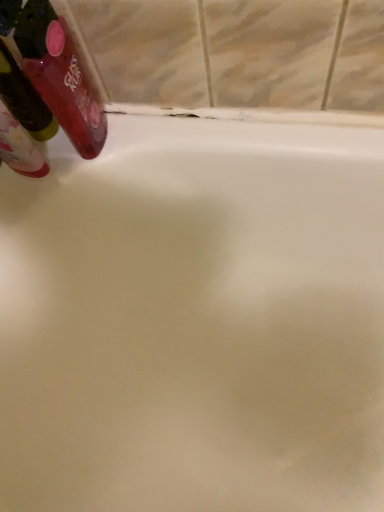
Find the location of `vacant area situated to the left side of translucent plastic mouthwash at upper left, arranged as the first mouthwash when viewed from the right`. vacant area situated to the left side of translucent plastic mouthwash at upper left, arranged as the first mouthwash when viewed from the right is located at coordinates (35, 187).